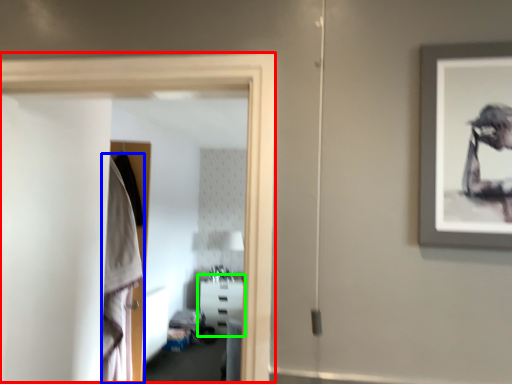
Question: Which object is the closest to the glass door (highlighted by a red box)? Choose among these: robe (highlighted by a blue box) or furniture (highlighted by a green box).

Choices:
 (A) robe
 (B) furniture

Answer: (A)